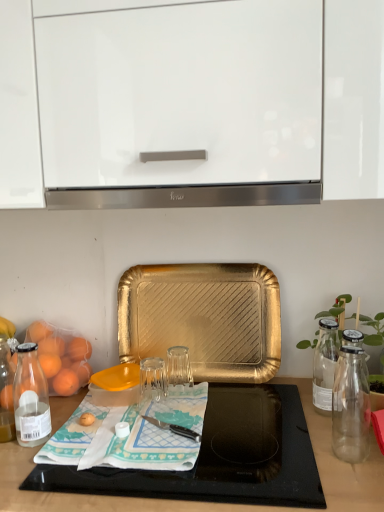
This screenshot has height=512, width=384. Find the location of `free space above transparent glass at center (from a real-world perspective)`. free space above transparent glass at center (from a real-world perspective) is located at coordinates (117, 373).